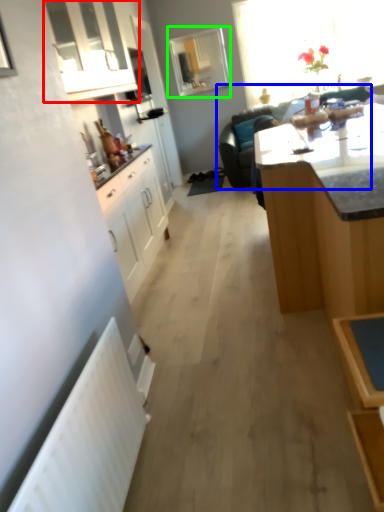
Question: Which object is the farthest from cabinetry (highlighted by a red box)? Choose among these: studio couch (highlighted by a blue box) or window (highlighted by a green box).

Choices:
 (A) studio couch
 (B) window

Answer: (B)